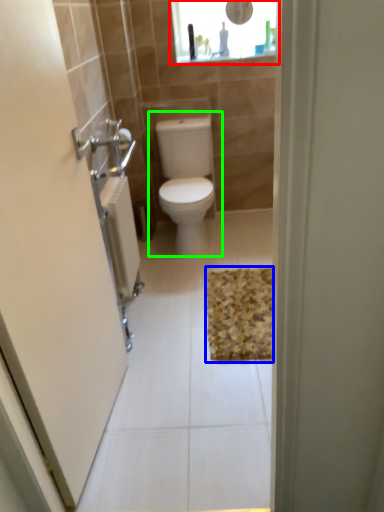
Question: Considering the real-world distances, which object is closest to medicine cabinet (highlighted by a red box)? bath mat (highlighted by a blue box) or toilet (highlighted by a green box).

Choices:
 (A) bath mat
 (B) toilet

Answer: (B)